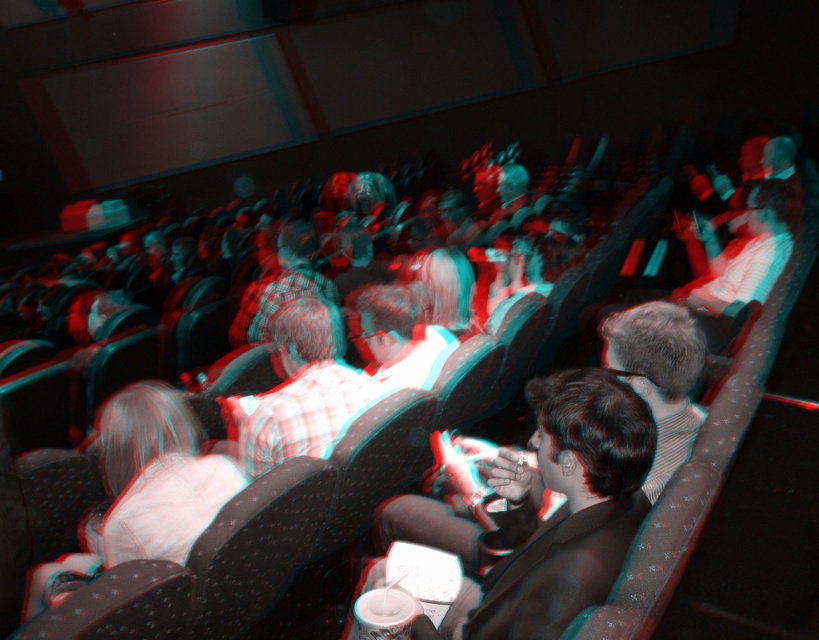
Is matte black suit at center to the left of plaid shirt at center from the viewer's perspective?

Incorrect, matte black suit at center is not on the left side of plaid shirt at center.

Measure the distance from matte black suit at center to plaid shirt at center.

matte black suit at center is 31.89 inches away from plaid shirt at center.

You are a GUI agent. You are given a task and a screenshot of the screen. Output one action in this format:
    pyautogui.click(x=<x>, y=<y>)
    Task: Click on the matte black suit at center
    This screenshot has width=819, height=640.
    Given the screenshot: What is the action you would take?
    pyautogui.click(x=555, y=512)

I want to click on matte black suit at center, so click(x=555, y=512).